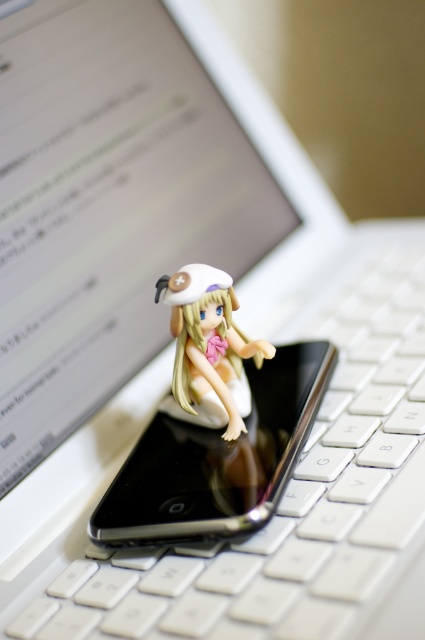
You are organizing your desk and want to place both the black glossy smartphone at center and the matte white figurine at center on a shelf. If the shelf has a maximum weight capacity of 1.5 kg, and the smartphone weighs 200 grams while the figurine weighs 1.2 kg, will both items fit within the weight limit?

The total weight of the black glossy smartphone at center and the matte white figurine at center is 1.4 kg, which is under the 1.5 kg limit. Both items can be placed on the shelf together.

You are trying to place a new sticker on your desk. You have two points marked on your desk at coordinates point (x=252, y=406) and point (x=221, y=314). If you want to place the sticker in front of the figurine, which point should you choose?

You should choose point (x=221, y=314) because it is in front of the figurine, as point (x=252, y=406) is behind point (x=221, y=314).

You are setting up a photo shoot and want to place a black glossy smartphone at center in your scene. According to the image, what 2D coordinate should you use to position it?

The 2D location of black glossy smartphone at center is at point (218, 460).